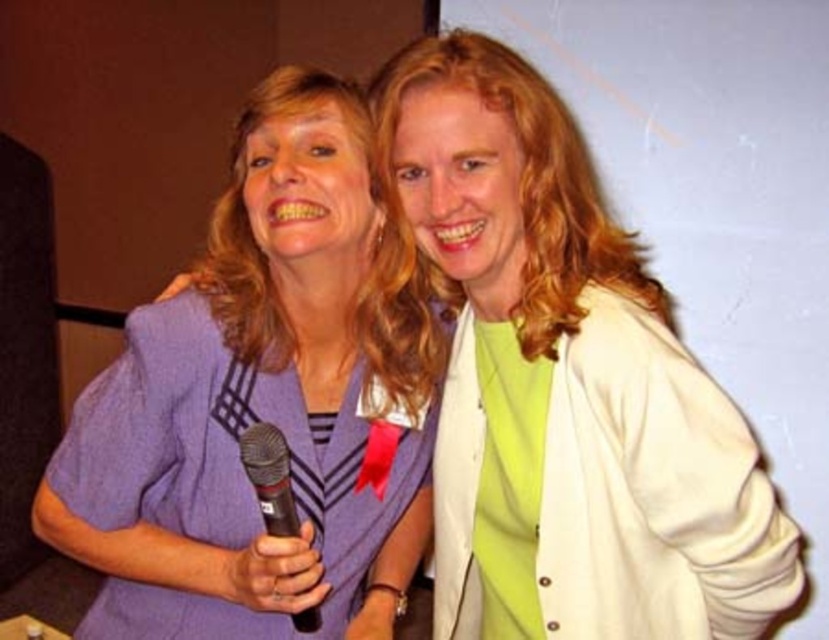
Looking at this image, you are a photographer at an event and need to capture a photo of the purple woolen blazer at left and the black matte microphone at center. Based on their positions, which object is closer to the right side of the frame?

The purple woolen blazer at left is positioned on the right side of the black matte microphone at center, so the purple woolen blazer at left is closer to the right side of the frame.

You are at an event and need to determine which object is taller between the purple woolen blazer at left and the black matte microphone at center. Based on the scene description, which one is taller?

The purple woolen blazer at left is much taller than the black matte microphone at center according to the description.